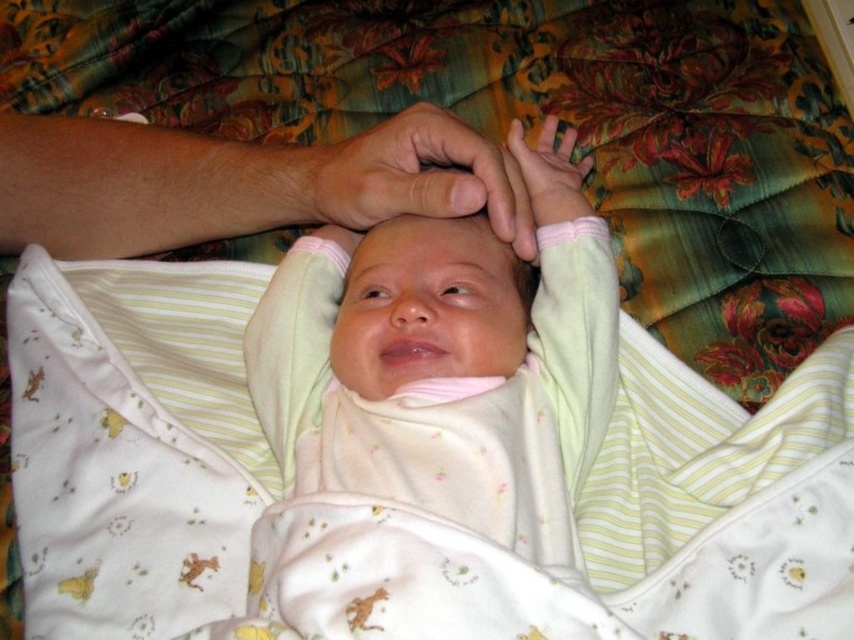
You are observing a baby in a light pink blanket and an adult interacting. The scene shows the smooth skin hand at center and the pink fabric at center. Which object is closer to you?

The smooth skin hand at center is closer to you because it is in front of the pink fabric at center.

You are a photographer trying to capture a closeup of the smooth skin hand at center. Your camera has a minimum focusing distance of 18 inches. Can you take the photo without moving the camera or the hand?

The smooth skin hand at center and camera are 19.62 inches apart from each other. Since the minimum focusing distance is 18 inches, the camera can focus on the smooth skin hand at center and take the photo without moving either.